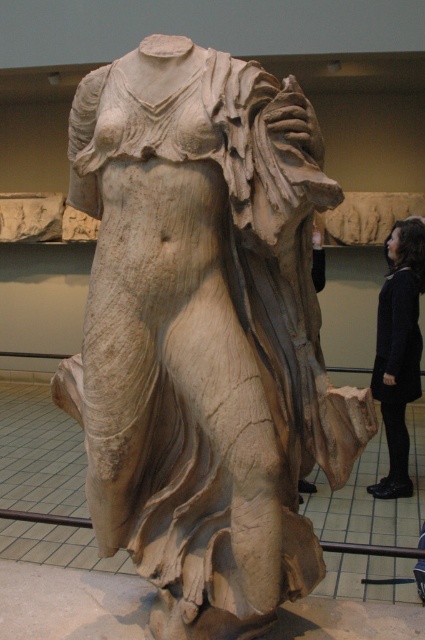
Who is more forward, (237, 372) or (410, 234)?

Point (237, 372) is in front.

Can you confirm if white marble statue at center is wider than dark woolen sweater at center?

Yes.

Locate an element on the screen. This screenshot has width=425, height=640. white marble statue at center is located at coordinates (204, 333).

Identify the location of white marble statue at center. (204, 333).